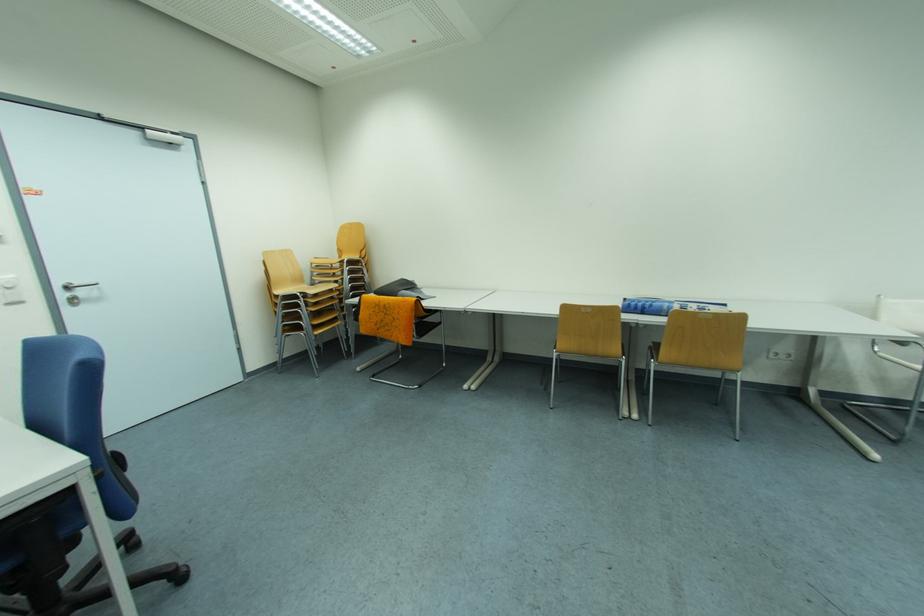
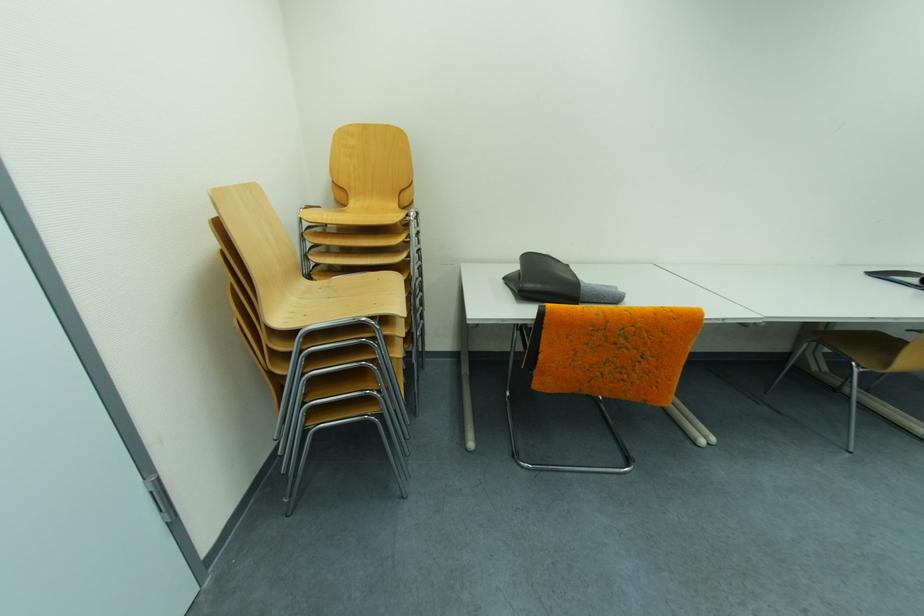
Locate, in the second image, the point that corresponds to [369,318] in the first image.

(549, 359)